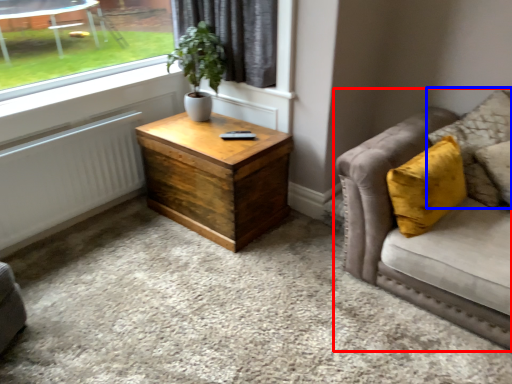
Question: Which object is further to the camera taking this photo, studio couch (highlighted by a red box) or pillow (highlighted by a blue box)?

Choices:
 (A) studio couch
 (B) pillow

Answer: (B)